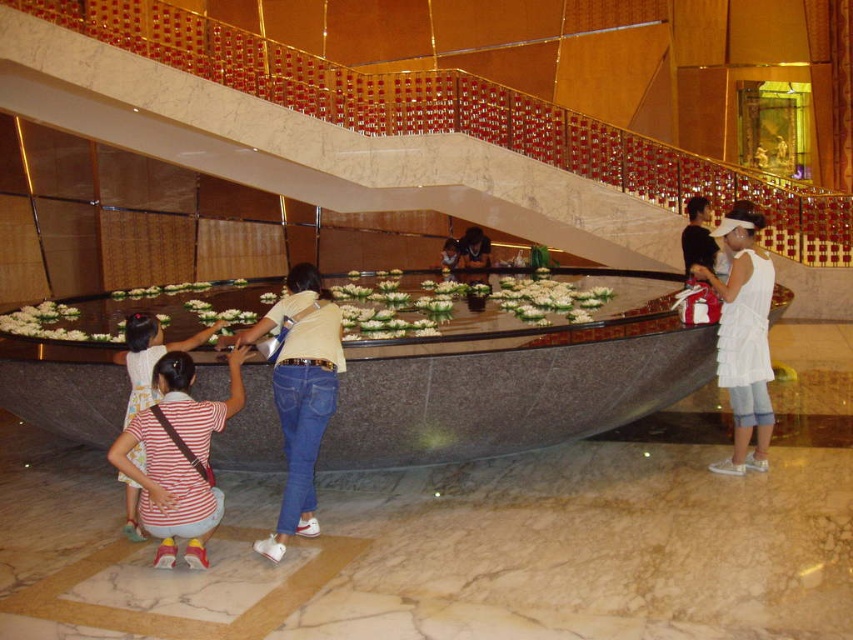
Between jeans at center and striped fabric shirt at lower left, which one appears on the left side from the viewer's perspective?

striped fabric shirt at lower left

Does jeans at center appear over striped fabric shirt at lower left?

Incorrect, jeans at center is not positioned above striped fabric shirt at lower left.

This screenshot has height=640, width=853. Describe the element at coordinates (300, 392) in the screenshot. I see `jeans at center` at that location.

You are a GUI agent. You are given a task and a screenshot of the screen. Output one action in this format:
    pyautogui.click(x=<x>, y=<y>)
    Task: Click on the jeans at center
    The image size is (853, 640).
    Given the screenshot: What is the action you would take?
    pyautogui.click(x=300, y=392)

Is jeans at center to the left of white cotton dress at right from the viewer's perspective?

Yes, jeans at center is to the left of white cotton dress at right.

Is the position of jeans at center less distant than that of white cotton dress at right?

Yes, jeans at center is in front of white cotton dress at right.

Is point (334, 369) closer to camera compared to point (741, 314)?

That is True.

At what (x,y) coordinates should I click in order to perform the action: click on jeans at center. Please return your answer as a coordinate pair (x, y). Looking at the image, I should click on (300, 392).

Is point (756, 406) positioned after point (166, 352)?

Yes, it is.

Where is `white cotton dress at right`? white cotton dress at right is located at coordinates (743, 337).